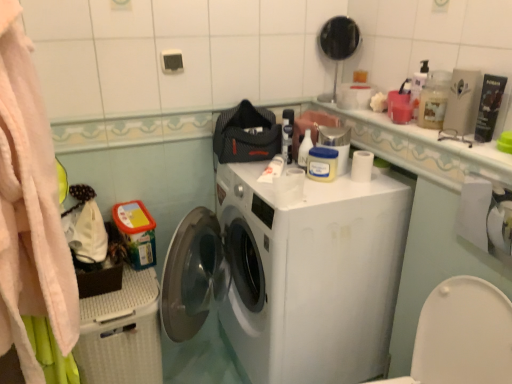
Identify the location of free space in front of white glossy bottle at upper center, positioned as the 1th cleaning product in left-to-right order. This screenshot has width=512, height=384. (320, 187).